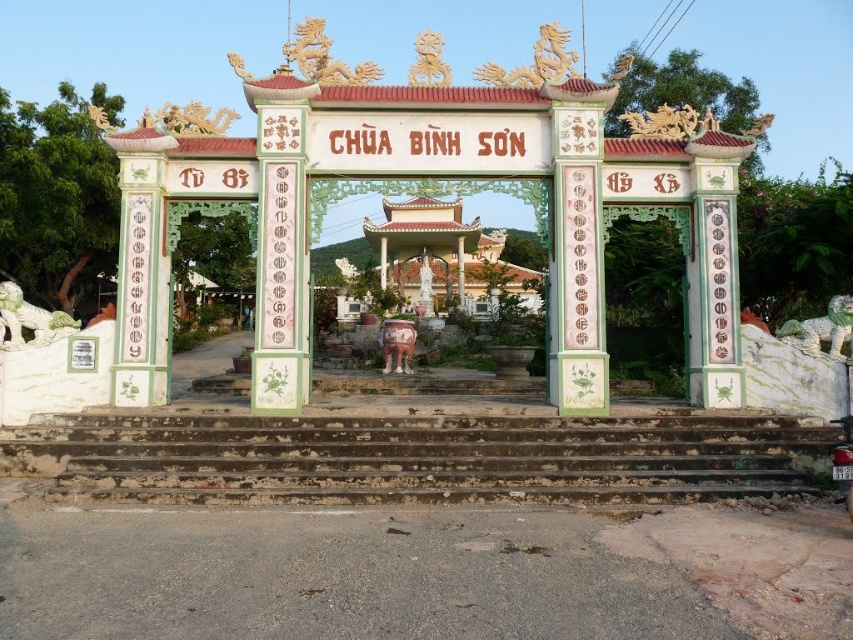
Who is taller, green painted wood gate at center or green stone lion at left?

green stone lion at left

Which is below, green painted wood gate at center or green stone lion at left?

green stone lion at left is below.

The image size is (853, 640). Describe the element at coordinates (647, 291) in the screenshot. I see `green painted wood gate at center` at that location.

Locate an element on the screen. green painted wood gate at center is located at coordinates (647, 291).

Who is lower down, green painted wood gate at center or white marble lion at right?

white marble lion at right

Is the position of green painted wood gate at center less distant than that of white marble lion at right?

No.

Image resolution: width=853 pixels, height=640 pixels. In order to click on green painted wood gate at center in this screenshot , I will do `click(647, 291)`.

The image size is (853, 640). Find the location of `dirty concrete stairs at center`. dirty concrete stairs at center is located at coordinates (421, 456).

Between point (334, 500) and point (651, 336), which one is positioned behind?

The point (651, 336) is more distant.

The image size is (853, 640). Identify the location of dirty concrete stairs at center. (421, 456).